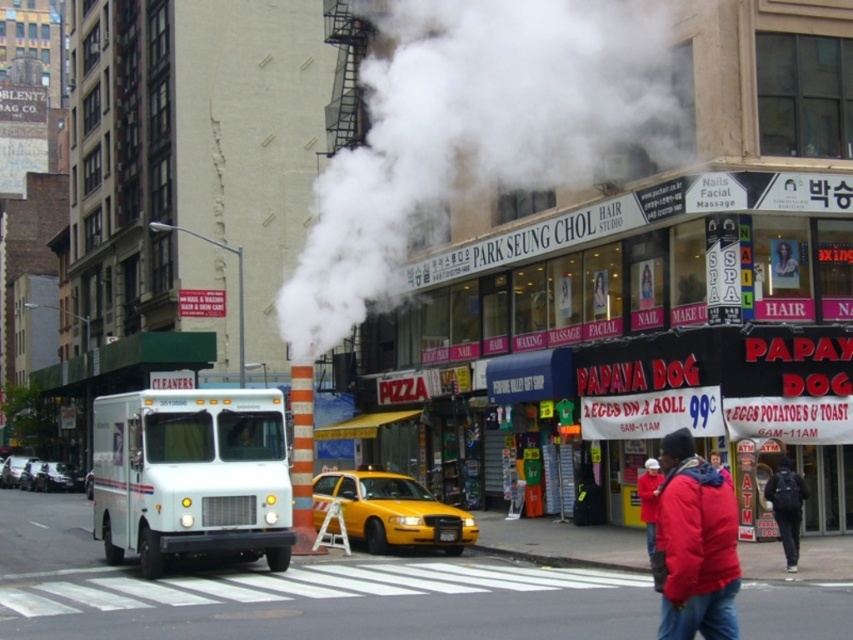
You are a pedestrian standing at the crosswalk in the foreground. You see a white steam at center and a red matte jacket at lower right. How far apart are these two objects?

The white steam at center and the red matte jacket at lower right are 23.81 meters apart.

You are a pedestrian standing on the sidewalk and see the white steam at center and the dark blue jacket at lower right. Which object is higher from the ground?

The white steam at center is located above the dark blue jacket at lower right, so it is higher from the ground.

You are a pedestrian standing on the sidewalk and you see the white steam at center and the red matte jacket at lower right. Which object is closer to the yellow taxi parked near the curb?

The red matte jacket at lower right is closer to the yellow taxi parked near the curb because the white steam at center is positioned on the left side of the red matte jacket at lower right, meaning the jacket is between the steam and the taxi.